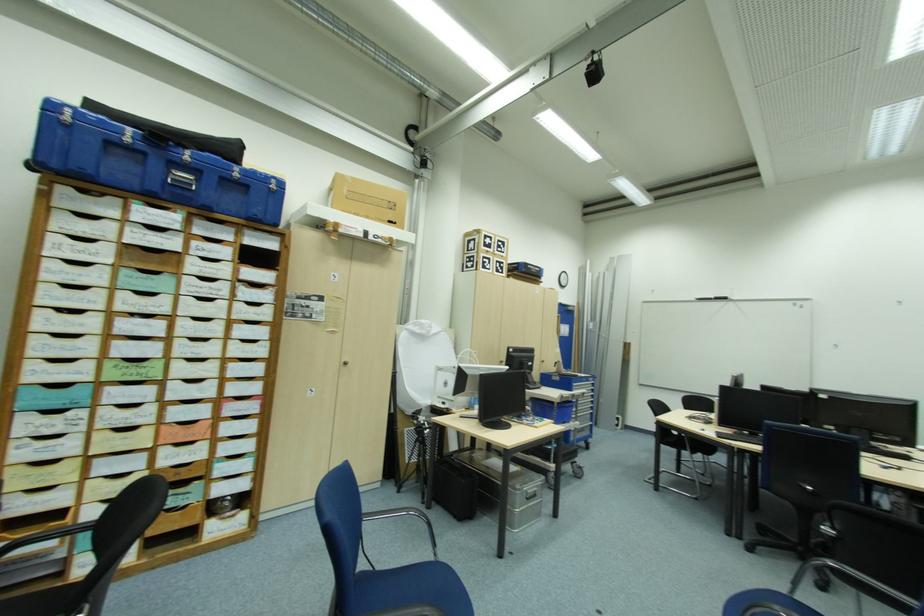
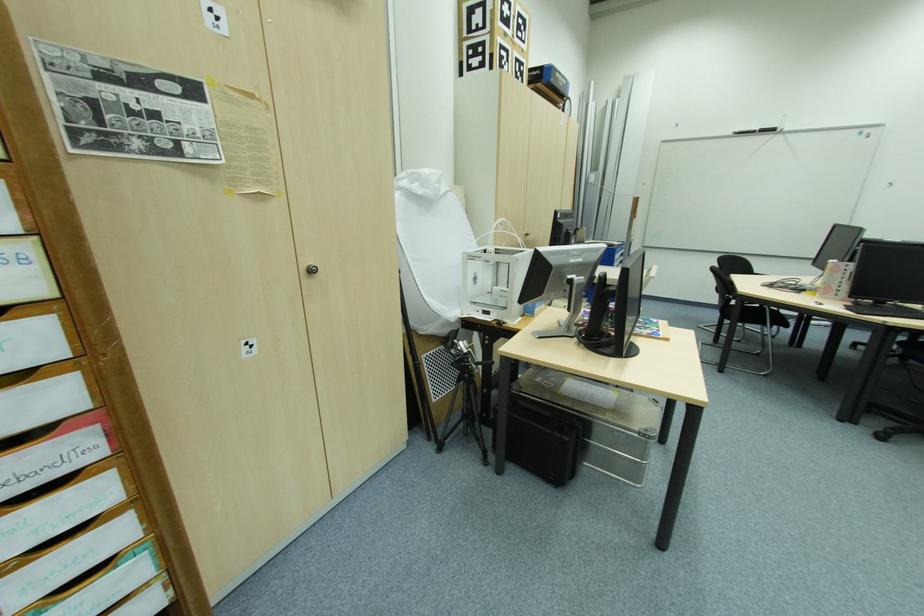
What movement of the cameraman would produce the second image?

The cameraman walked toward left, forward.